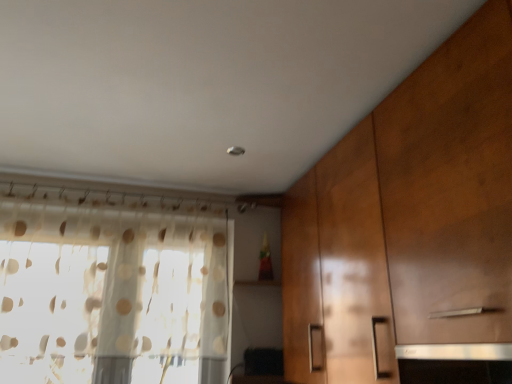
Measure the distance between translucent fabric curtain at left and camera.

The depth of translucent fabric curtain at left is 6.16 feet.

What do you see at coordinates (113, 288) in the screenshot? I see `translucent fabric curtain at left` at bounding box center [113, 288].

This screenshot has height=384, width=512. I want to click on translucent fabric curtain at left, so click(x=113, y=288).

The width and height of the screenshot is (512, 384). What do you see at coordinates (410, 225) in the screenshot?
I see `wooden cabinet at right` at bounding box center [410, 225].

The height and width of the screenshot is (384, 512). Identify the location of wooden cabinet at right. (410, 225).

This screenshot has height=384, width=512. I want to click on translucent fabric curtain at left, so click(x=113, y=288).

Which object is positioned more to the right, translucent fabric curtain at left or wooden cabinet at right?

From the viewer's perspective, wooden cabinet at right appears more on the right side.

In the image, is translucent fabric curtain at left positioned in front of or behind wooden cabinet at right?

Clearly, translucent fabric curtain at left is behind wooden cabinet at right.

Is point (60, 323) farther from camera compared to point (431, 151)?

Yes, point (60, 323) is farther from viewer.

From the image's perspective, between translucent fabric curtain at left and wooden cabinet at right, who is located below?

translucent fabric curtain at left is shown below in the image.

From a real-world perspective, is translucent fabric curtain at left on top of wooden cabinet at right?

Yes.

Is translucent fabric curtain at left thinner than wooden cabinet at right?

Indeed, translucent fabric curtain at left has a lesser width compared to wooden cabinet at right.

Which of these two, translucent fabric curtain at left or wooden cabinet at right, stands taller?

wooden cabinet at right.

Is translucent fabric curtain at left smaller than wooden cabinet at right?

Yes.

Would you say translucent fabric curtain at left is inside or outside wooden cabinet at right?

translucent fabric curtain at left is outside wooden cabinet at right.

Is there a large distance between translucent fabric curtain at left and wooden cabinet at right?

Yes, translucent fabric curtain at left and wooden cabinet at right are located far from each other.

Could you tell me if translucent fabric curtain at left is turned towards wooden cabinet at right?

Yes, translucent fabric curtain at left is aimed at wooden cabinet at right.

In the scene shown: How different are the orientations of translucent fabric curtain at left and wooden cabinet at right in degrees?

89.2 degrees separate the facing orientations of translucent fabric curtain at left and wooden cabinet at right.

At what (x,y) coordinates should I click in order to perform the action: click on cabinetry that is above the translucent fabric curtain at left (from the image's perspective). Please return your answer as a coordinate pair (x, y). This screenshot has width=512, height=384. Looking at the image, I should click on (410, 225).

Which object is positioned more to the left, wooden cabinet at right or translucent fabric curtain at left?

translucent fabric curtain at left.

From the picture: Relative to translucent fabric curtain at left, is wooden cabinet at right in front or behind?

wooden cabinet at right is in front of translucent fabric curtain at left.

Is point (391, 192) farther from camera compared to point (133, 329)?

No, (391, 192) is in front of (133, 329).

From the image's perspective, which one is positioned higher, wooden cabinet at right or translucent fabric curtain at left?

From the image's view, wooden cabinet at right is above.

From a real-world perspective, which is physically below, wooden cabinet at right or translucent fabric curtain at left?

From a 3D spatial view, wooden cabinet at right is below.

Based on the photo, looking at their sizes, would you say wooden cabinet at right is wider or thinner than translucent fabric curtain at left?

wooden cabinet at right is wider than translucent fabric curtain at left.

Between wooden cabinet at right and translucent fabric curtain at left, which one has more height?

Standing taller between the two is wooden cabinet at right.

From the picture: Looking at the image, does wooden cabinet at right seem bigger or smaller compared to translucent fabric curtain at left?

Clearly, wooden cabinet at right is larger in size than translucent fabric curtain at left.

In the scene shown: Would you say translucent fabric curtain at left is part of wooden cabinet at right's contents?

No, wooden cabinet at right does not contain translucent fabric curtain at left.

Is wooden cabinet at right not close to translucent fabric curtain at left?

Yes.

Is wooden cabinet at right looking in the opposite direction of translucent fabric curtain at left?

wooden cabinet at right is not turned away from translucent fabric curtain at left.

At what (x,y) coordinates should I click in order to perform the action: click on cabinetry that appears on the right of translucent fabric curtain at left. Please return your answer as a coordinate pair (x, y). The height and width of the screenshot is (384, 512). Looking at the image, I should click on (410, 225).

Locate an element on the screen. The width and height of the screenshot is (512, 384). cabinetry in front of the translucent fabric curtain at left is located at coordinates (410, 225).

Find the location of a particular element. The image size is (512, 384). cabinetry above the translucent fabric curtain at left (from the image's perspective) is located at coordinates (410, 225).